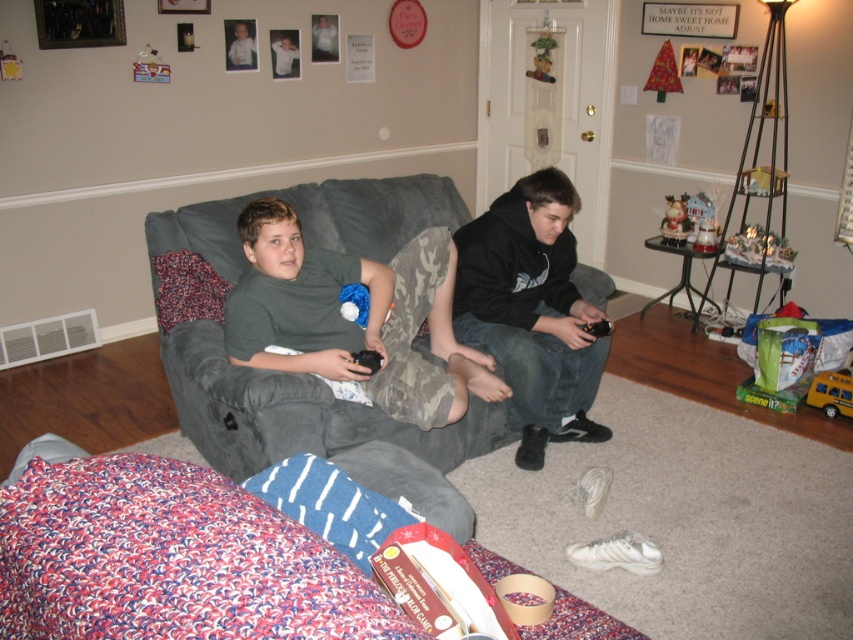
Question: Can you confirm if green cotton shirt at center is smaller than light blue shirt at center?

Choices:
 (A) yes
 (B) no

Answer: (B)

Question: Based on their relative distances, which object is nearer to the black matte hoodie at center?

Choices:
 (A) gray fabric couch at center
 (B) light blue shirt at center
 (C) green cotton shirt at center

Answer: (C)

Question: Which of the following is the closest to the observer?

Choices:
 (A) green cotton shirt at center
 (B) gray fabric couch at center

Answer: (B)

Question: Observing the image, what is the correct spatial positioning of green cotton shirt at center in reference to black matte hoodie at center?

Choices:
 (A) below
 (B) above

Answer: (A)

Question: Which point is closer to the camera?

Choices:
 (A) light blue shirt at center
 (B) green cotton shirt at center
 (C) black matte hoodie at center

Answer: (B)

Question: Where is green cotton shirt at center located in relation to light blue shirt at center in the image?

Choices:
 (A) left
 (B) right

Answer: (B)